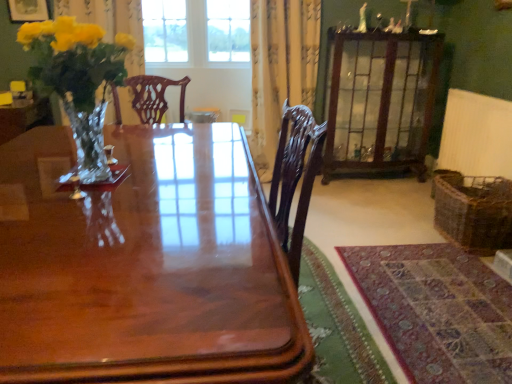
Question: From the image's perspective, is shiny glass vase with yellow flowers at left above or below clear glass window at upper center?

Choices:
 (A) above
 (B) below

Answer: (B)

Question: Is shiny glass vase with yellow flowers at left taller or shorter than clear glass window at upper center?

Choices:
 (A) short
 (B) tall

Answer: (A)

Question: Considering the real-world distances, which object is farthest from the white textured radiator at right?

Choices:
 (A) woven brown basket at lower right
 (B) clear glass window at upper center
 (C) matte gold picture frame at upper left
 (D) wooden glass cabinet at upper right
 (E) glossy wood table at center

Answer: (C)

Question: Which of these objects is positioned closest to the matte gold picture frame at upper left?

Choices:
 (A) white textured radiator at right
 (B) wooden glass cabinet at upper right
 (C) clear glass window at upper center
 (D) rug with intricate patterns at lower right
 (E) yellow floral-patterned curtain at upper center

Answer: (C)